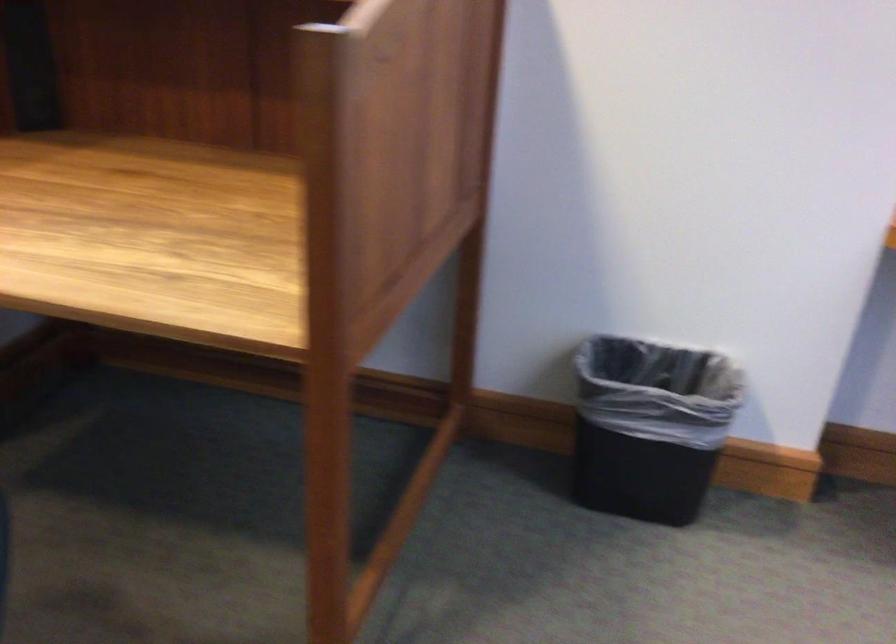
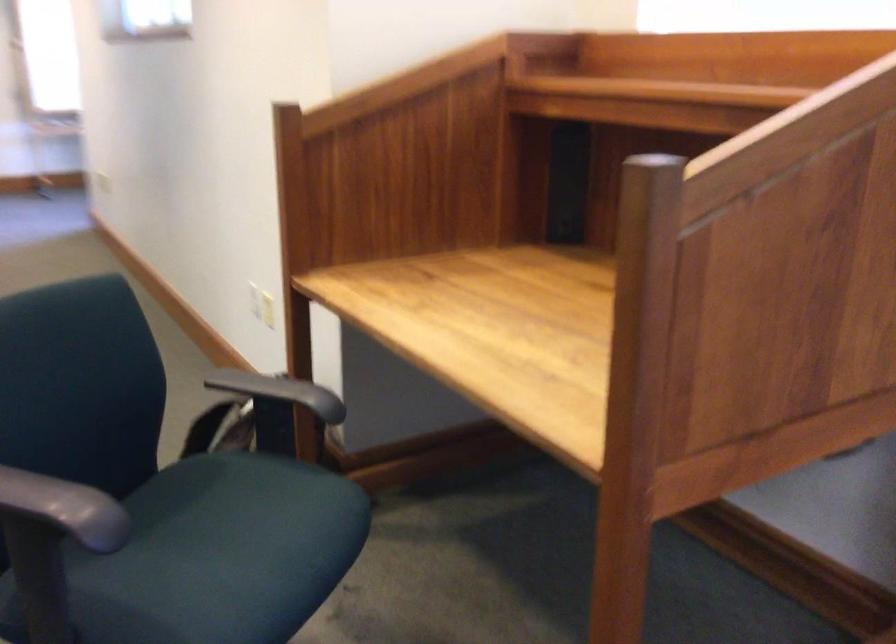
Question: The camera is either moving clockwise (left) or counter-clockwise (right) around the object. The first image is from the beginning of the video and the second image is from the end. Is the camera moving left or right when shooting the video?

Choices:
 (A) Left
 (B) Right

Answer: (B)